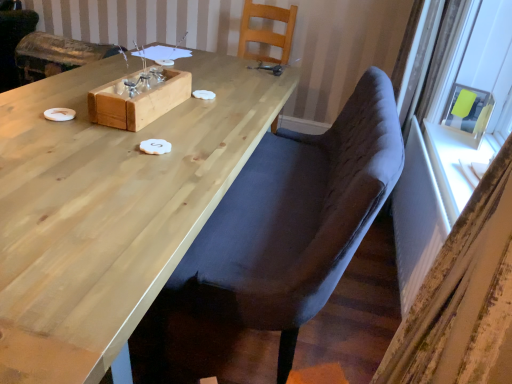
Locate an element on the screen. free spot in front of wooden box at center is located at coordinates (118, 142).